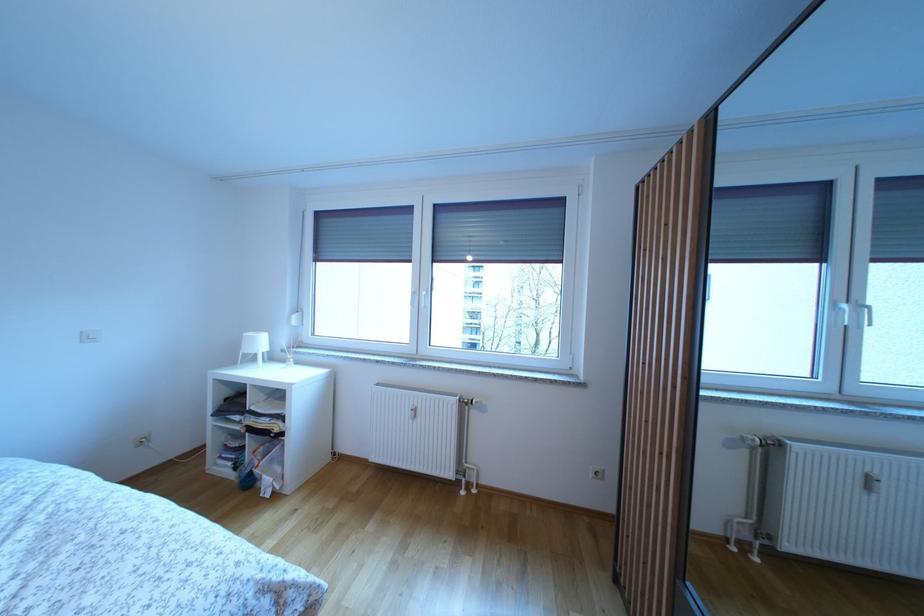
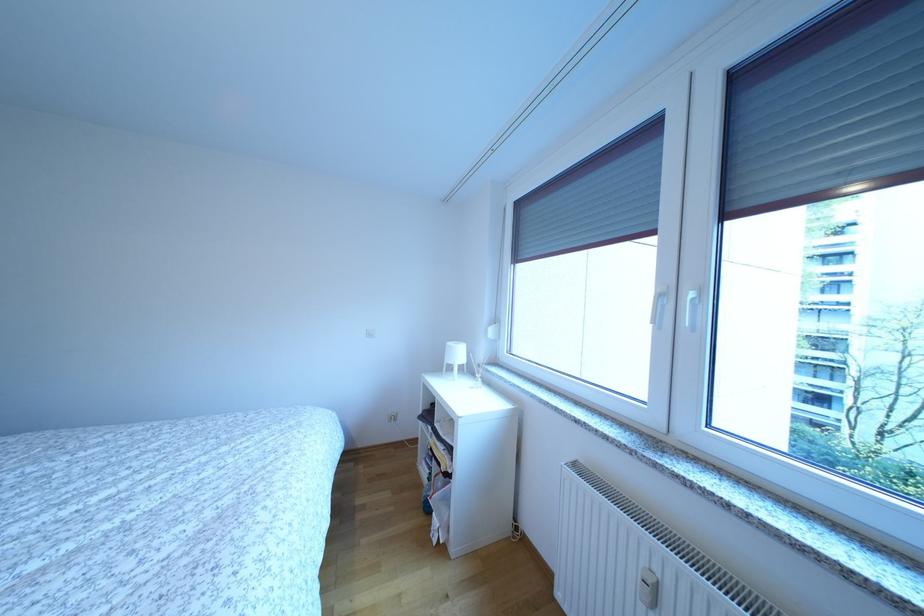
Question: The camera is either moving clockwise (left) or counter-clockwise (right) around the object. The first image is from the beginning of the video and the second image is from the end. Is the camera moving left or right when shooting the video?

Choices:
 (A) Left
 (B) Right

Answer: (B)